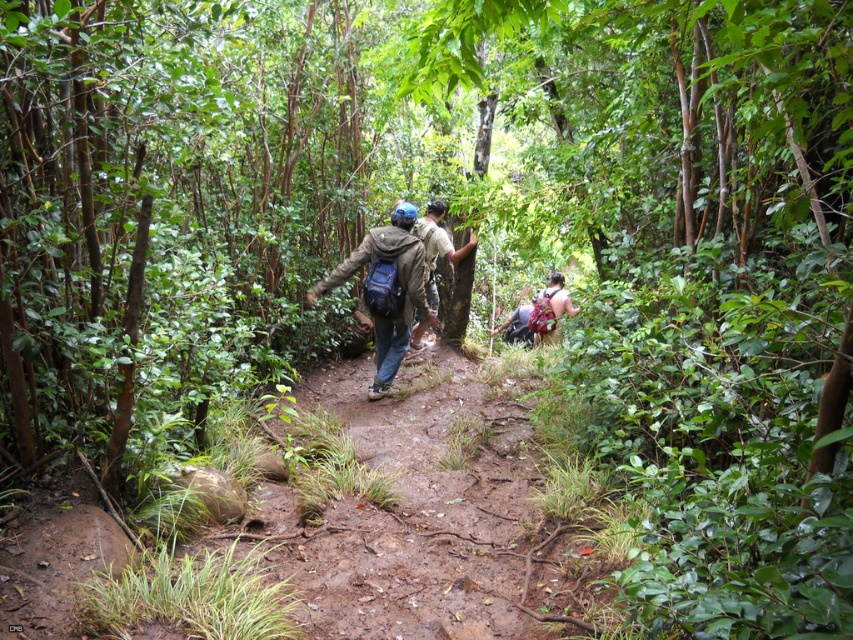
Question: Estimate the real-world distances between objects in this image. Which object is closer to the camouflage fabric backpack at center?

Choices:
 (A) matte green jacket at center
 (B) matte blue backpack at center

Answer: (B)

Question: Which of the following is the farthest from the observer?

Choices:
 (A) (537, 310)
 (B) (416, 305)
 (C) (425, 224)

Answer: (A)

Question: From the image, what is the correct spatial relationship of matte green jacket at center in relation to matte blue backpack at center?

Choices:
 (A) left
 (B) right

Answer: (A)

Question: Does matte green jacket at center appear over camouflage fabric backpack at center?

Choices:
 (A) no
 (B) yes

Answer: (B)

Question: Which point is closer to the camera?

Choices:
 (A) (560, 280)
 (B) (376, 305)
 (C) (432, 296)

Answer: (B)

Question: Can you confirm if matte green jacket at center is positioned to the right of camouflage fabric backpack at center?

Choices:
 (A) no
 (B) yes

Answer: (A)